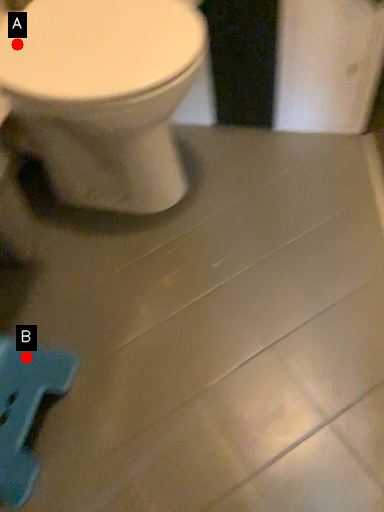
Question: Two points are circled on the image, labeled by A and B beside each circle. Which point appears closest to the camera in this image?

Choices:
 (A) A is closer
 (B) B is closer

Answer: (B)